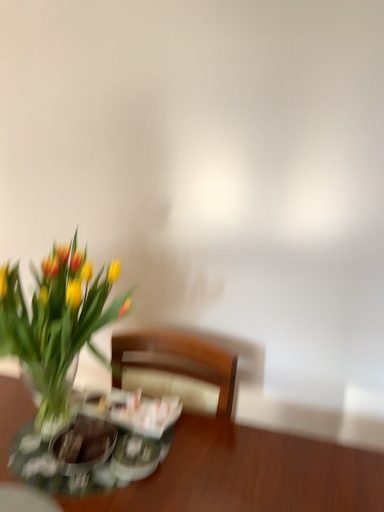
Question: From a real-world perspective, does translucent glass vase at left sit lower than wooden table at lower left?

Choices:
 (A) no
 (B) yes

Answer: (A)

Question: Considering the relative sizes of translucent glass vase at left and wooden table at lower left in the image provided, is translucent glass vase at left thinner than wooden table at lower left?

Choices:
 (A) no
 (B) yes

Answer: (B)

Question: Is translucent glass vase at left outside of wooden table at lower left?

Choices:
 (A) yes
 (B) no

Answer: (A)

Question: Considering the relative sizes of translucent glass vase at left and wooden table at lower left in the image provided, is translucent glass vase at left smaller than wooden table at lower left?

Choices:
 (A) no
 (B) yes

Answer: (B)

Question: Is translucent glass vase at left looking in the opposite direction of wooden table at lower left?

Choices:
 (A) no
 (B) yes

Answer: (A)

Question: Is translucent glass vase at left further to the viewer compared to wooden table at lower left?

Choices:
 (A) yes
 (B) no

Answer: (B)

Question: Does wooden table at lower left appear on the left side of translucent glass vase at left?

Choices:
 (A) yes
 (B) no

Answer: (B)

Question: Is wooden table at lower left positioned behind translucent glass vase at left?

Choices:
 (A) no
 (B) yes

Answer: (B)

Question: Is wooden table at lower left looking in the opposite direction of translucent glass vase at left?

Choices:
 (A) no
 (B) yes

Answer: (A)

Question: Is the surface of wooden table at lower left in direct contact with translucent glass vase at left?

Choices:
 (A) no
 (B) yes

Answer: (A)

Question: Is wooden table at lower left bigger than translucent glass vase at left?

Choices:
 (A) no
 (B) yes

Answer: (B)

Question: Can you confirm if wooden table at lower left is wider than translucent glass vase at left?

Choices:
 (A) no
 (B) yes

Answer: (B)

Question: From a real-world perspective, relative to translucent glass vase at left, is wooden table at lower left vertically above or below?

Choices:
 (A) above
 (B) below

Answer: (B)